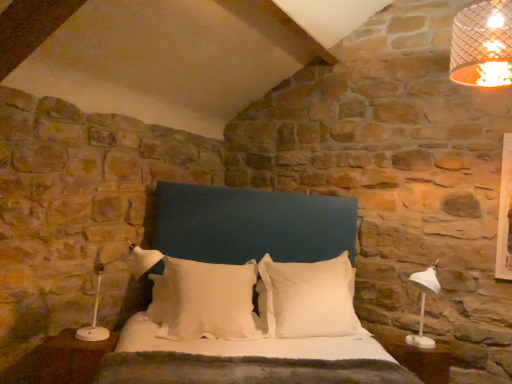
Question: Which direction should I rotate to look at white soft pillow at center, which ranks as the first pillow in left-to-right order, — up or down?

Choices:
 (A) up
 (B) down

Answer: (B)

Question: Is brown wood nightstand at lower left oriented away from white plastic lamp at left?

Choices:
 (A) yes
 (B) no

Answer: (B)

Question: Could you tell me if brown wood nightstand at lower left is turned towards white plastic lamp at left?

Choices:
 (A) no
 (B) yes

Answer: (A)

Question: Is brown wood nightstand at lower left positioned beyond the bounds of white plastic lamp at left?

Choices:
 (A) no
 (B) yes

Answer: (B)

Question: Can you confirm if brown wood nightstand at lower left is positioned to the left of white plastic lamp at left?

Choices:
 (A) yes
 (B) no

Answer: (A)

Question: From a real-world perspective, is brown wood nightstand at lower left on top of white plastic lamp at left?

Choices:
 (A) yes
 (B) no

Answer: (B)

Question: From a real-world perspective, is brown wood nightstand at lower left positioned under white plastic lamp at left based on gravity?

Choices:
 (A) yes
 (B) no

Answer: (A)

Question: Is white soft pillow at center, which ranks as the first pillow in left-to-right order, positioned before white plastic side table at lower right?

Choices:
 (A) yes
 (B) no

Answer: (B)

Question: Is white soft pillow at center, which ranks as the first pillow in left-to-right order, not near white plastic side table at lower right?

Choices:
 (A) no
 (B) yes

Answer: (B)

Question: Is white plastic side table at lower right located within white soft pillow at center, positioned as the second pillow in right-to-left order?

Choices:
 (A) no
 (B) yes

Answer: (A)

Question: Is white soft pillow at center, which ranks as the first pillow in left-to-right order, oriented away from white plastic side table at lower right?

Choices:
 (A) no
 (B) yes

Answer: (A)

Question: Does white soft pillow at center, positioned as the second pillow in right-to-left order, have a greater height compared to white plastic side table at lower right?

Choices:
 (A) no
 (B) yes

Answer: (B)

Question: From the image's perspective, is white soft pillow at center, positioned as the second pillow in right-to-left order, below white plastic side table at lower right?

Choices:
 (A) yes
 (B) no

Answer: (B)

Question: Does white soft pillow at center, which ranks as the first pillow in left-to-right order, have a greater height compared to white soft pillow at center, the 2th pillow positioned from the left?

Choices:
 (A) yes
 (B) no

Answer: (B)